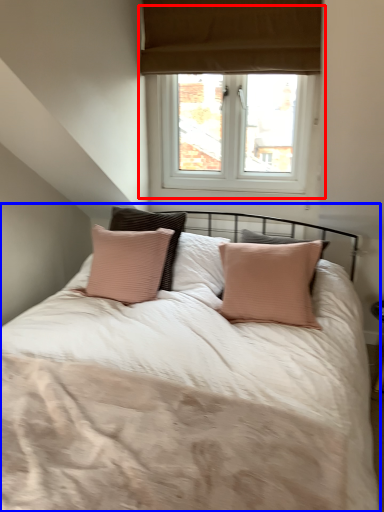
Question: Which point is further to the camera, window (highlighted by a red box) or bed (highlighted by a blue box)?

Choices:
 (A) window
 (B) bed

Answer: (A)